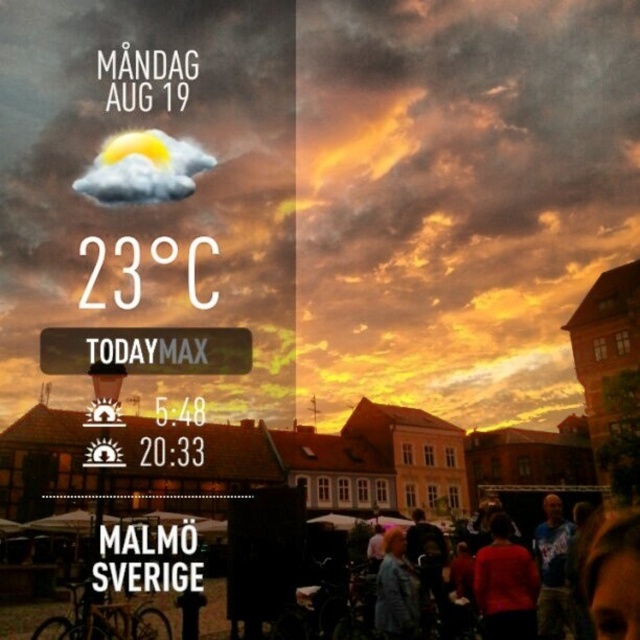
Does matte red sweater at lower right appear on the right side of denim jacket at lower right?

Correct, you'll find matte red sweater at lower right to the right of denim jacket at lower right.

Does matte red sweater at lower right have a greater height compared to denim jacket at lower right?

Indeed, matte red sweater at lower right has a greater height compared to denim jacket at lower right.

Describe the element at coordinates (506, 584) in the screenshot. I see `matte red sweater at lower right` at that location.

Where is `matte red sweater at lower right`? matte red sweater at lower right is located at coordinates (506, 584).

Describe the element at coordinates (316, 193) in the screenshot. I see `cloudytexturedsky at upper center` at that location.

Is cloudytexturedsky at upper center shorter than denim jacket at lower right?

In fact, cloudytexturedsky at upper center may be taller than denim jacket at lower right.

Between point (593, 234) and point (401, 620), which one is positioned in front?

Point (401, 620) is in front.

Find the location of a particular element. This screenshot has height=640, width=640. cloudytexturedsky at upper center is located at coordinates click(x=316, y=193).

Who is more distant from viewer, (244, 308) or (365, 502)?

Positioned behind is point (365, 502).

Who is more forward, (236,8) or (548,435)?

Point (236,8) is in front.

Identify the location of cloudytexturedsky at upper center. Image resolution: width=640 pixels, height=640 pixels. (316, 193).